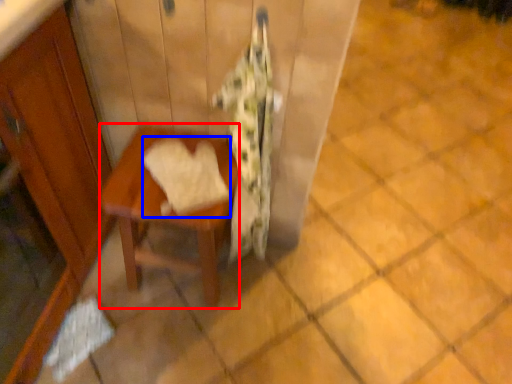
Question: Which of the following is the closest to the observer, table (highlighted by a red box) or bath towel (highlighted by a blue box)?

Choices:
 (A) table
 (B) bath towel

Answer: (B)